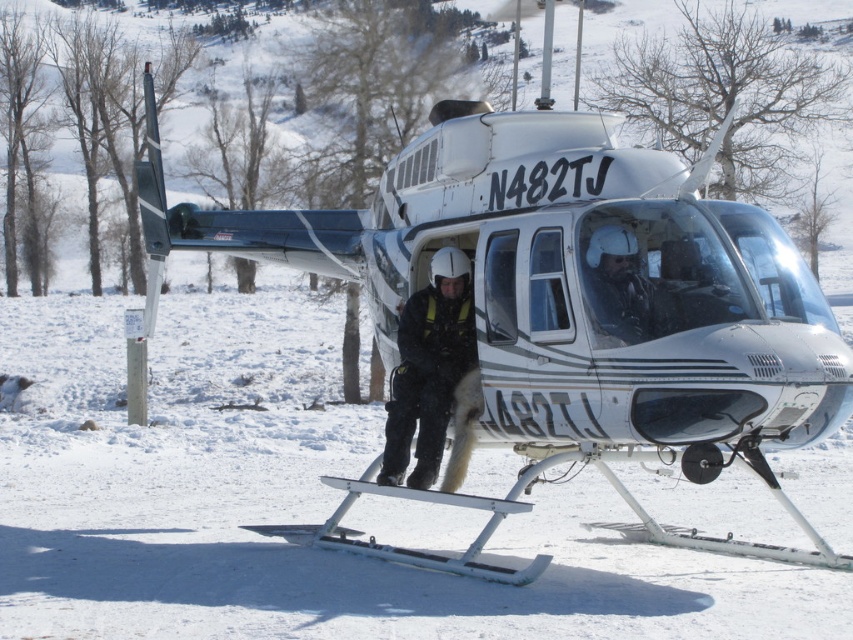
You are a photographer trying to capture a clear shot of the white glossy helicopter at center and the black matte uniform at center. Since you want the helicopter to be the main focus, which object should you adjust your camera to prioritize in terms of depth of field?

The white glossy helicopter at center is closer to the viewer than the black matte uniform at center, so you should adjust your camera to prioritize the helicopter in the depth of field to ensure it remains sharp while the uniform may appear slightly out of focus.

You are standing at the point with coordinates point (628,272) and want to walk to the point with coordinates point (445,136). Based on the scene, is the destination point behind you or in front of you?

The point (445,136) is behind point (628,272), so the destination point is behind you.

You are a maintenance worker needing to reach the matte black helmet at center from the black matte uniform at center. Given that your reach is 1.5 meters, can you comfortably extend your arm to grab it without moving your position?

The distance between black matte uniform at center and matte black helmet at center is 1.45 meters, which is within your 1.5 meter reach. Yes, you can comfortably grab it without moving.